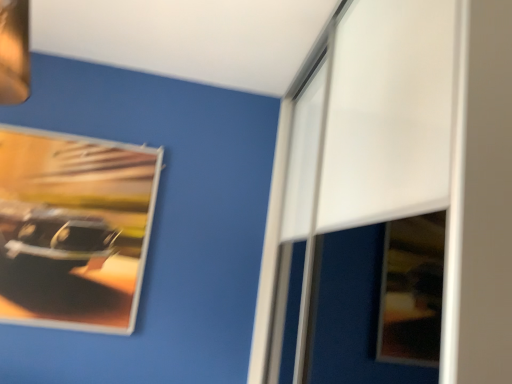
Question: Should I look upward or downward to see metallic reflective poster at upper left?

Choices:
 (A) up
 (B) down

Answer: (B)